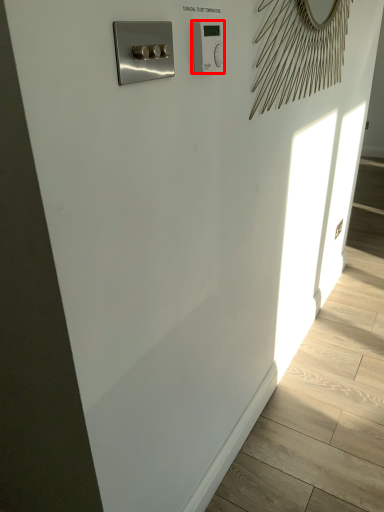
Question: Considering the relative positions of light switch (annotated by the red box) and switch in the image provided, where is light switch (annotated by the red box) located with respect to the staircase?

Choices:
 (A) left
 (B) right

Answer: (B)